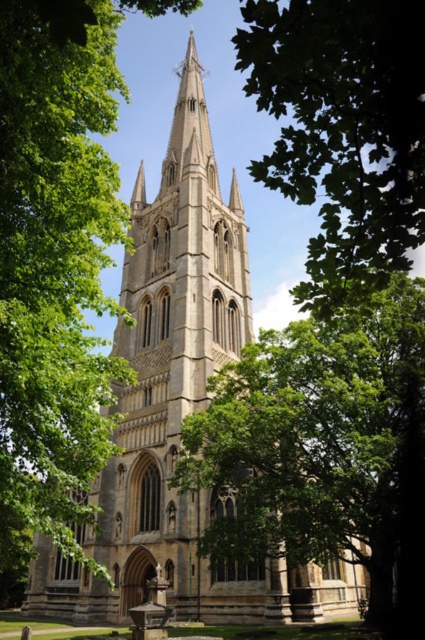
Is green leafy tree at center wider than green leafy tree at upper center?

Correct, the width of green leafy tree at center exceeds that of green leafy tree at upper center.

Is point (252, 442) behind point (410, 166)?

Yes, it is behind point (410, 166).

Find the location of a particular element. green leafy tree at center is located at coordinates [323, 448].